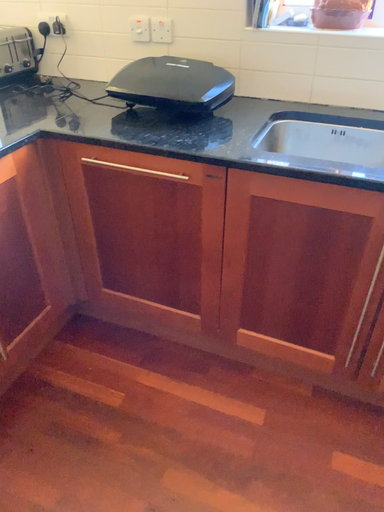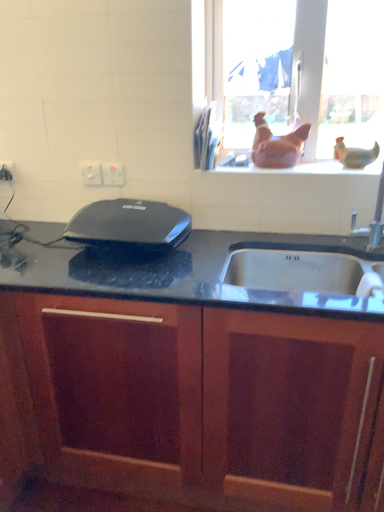
Question: How did the camera likely rotate when shooting the video?

Choices:
 (A) rotated upward
 (B) rotated downward

Answer: (A)